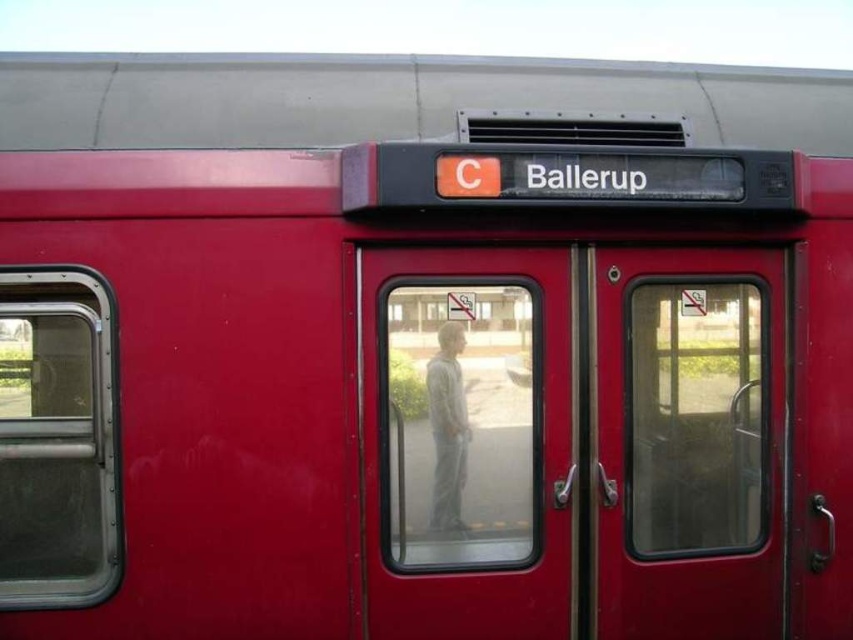
Who is higher up, matte glass door at center or gray fabric pants at center?

gray fabric pants at center

Is matte glass door at center taller than gray fabric pants at center?

Correct, matte glass door at center is much taller as gray fabric pants at center.

Where is `matte glass door at center`? The image size is (853, 640). matte glass door at center is located at coordinates (689, 442).

Does transparent glass door at center lie behind matte glass door at center?

No, it is in front of matte glass door at center.

How distant is transparent glass door at center from matte glass door at center?

transparent glass door at center is 17.89 inches from matte glass door at center.

This screenshot has width=853, height=640. I want to click on transparent glass door at center, so click(463, 442).

Is transparent glass door at center taller than gray fabric pants at center?

Yes, transparent glass door at center is taller than gray fabric pants at center.

Is transparent glass door at center bigger than gray fabric pants at center?

Correct, transparent glass door at center is larger in size than gray fabric pants at center.

Between point (554, 481) and point (460, 493), which one is positioned in front?

Positioned in front is point (460, 493).

You are a GUI agent. You are given a task and a screenshot of the screen. Output one action in this format:
    pyautogui.click(x=<x>, y=<y>)
    Task: Click on the transparent glass door at center
    The image size is (853, 640).
    Given the screenshot: What is the action you would take?
    coord(463,442)